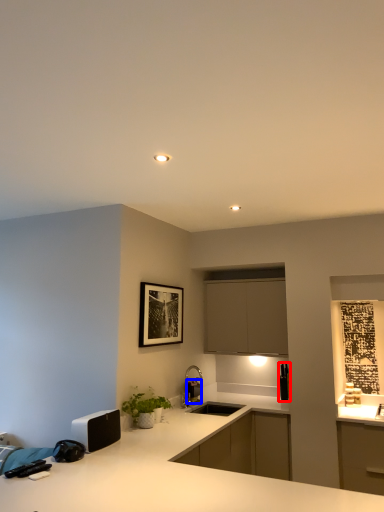
Question: Which of the following is the farthest to the observer, appliance (highlighted by a red box) or appliance (highlighted by a blue box)?

Choices:
 (A) appliance
 (B) appliance

Answer: (A)